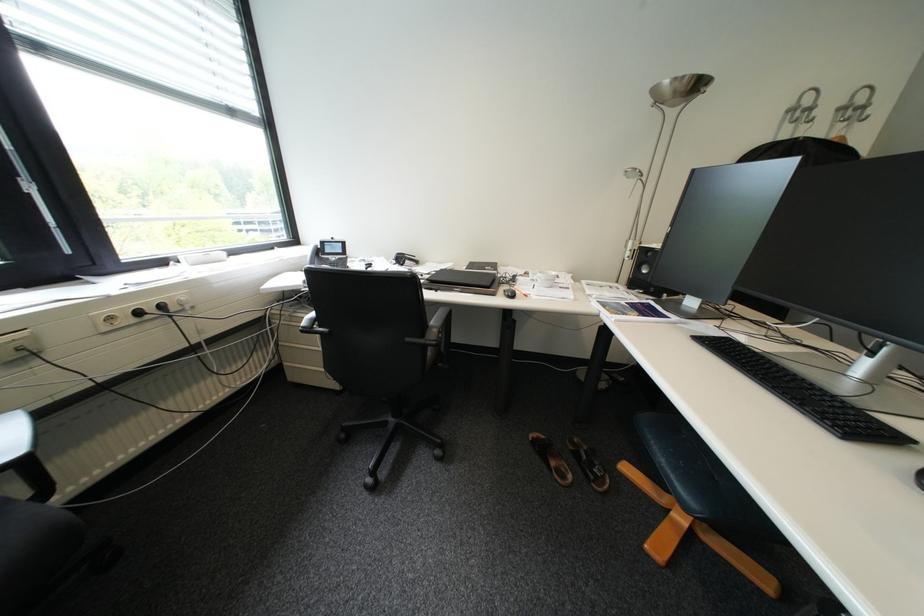
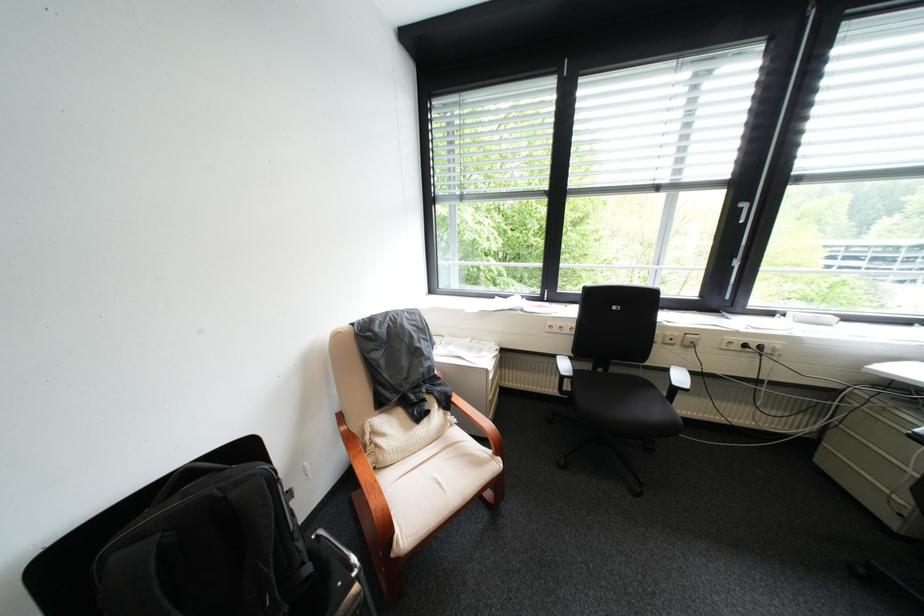
Based on the continuous images, in which direction is the camera rotating?

The camera's rotation is toward left-down.